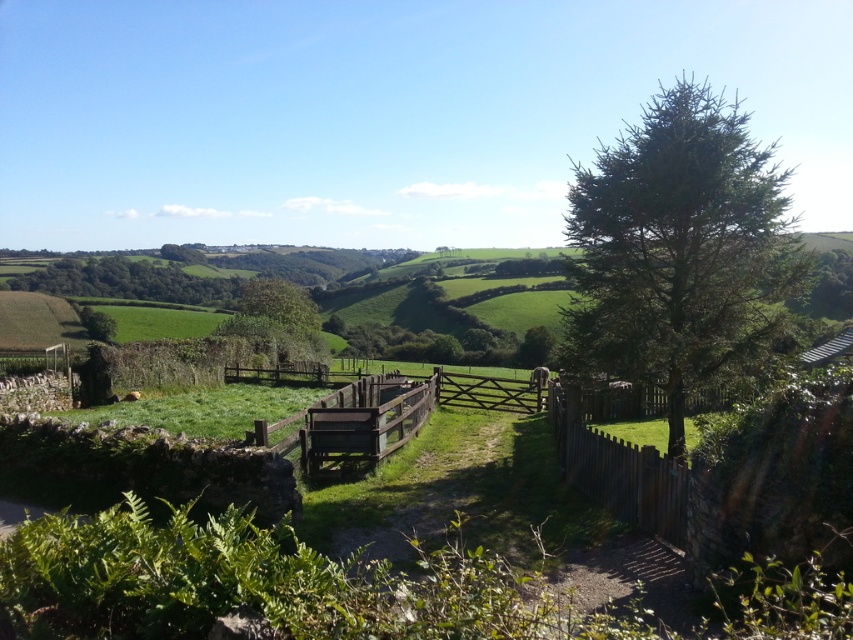
You are a painter setting up your easel in the countryside scene. You want to paint both the brown wooden fence at right and the brown wooden fence at center. Which fence should you move closer to if you want to capture more details of the fence in your painting?

You should move closer to the brown wooden fence at right because it is smaller in size compared to the brown wooden fence at center, allowing you to include more details of its structure in your painting when viewed from a closer distance.

From the picture: You are standing at the point marked as point [630,490] in the image. A friend is located 10 meters directly behind you. Can your friend see the stone wall on the left side of the image from their position?

The distance between you and the viewer is 9.30 meters. Since your friend is 10 meters behind you, they would be 19.30 meters away from the stone wall. The visibility depends on the terrain and obstructions, but the description mentions rolling hills and fields, which might block the view. However, the stone wall is in the foreground, so if there are no tall obstructions between them and the wall, they might see it. But the scene doesn t specify line of sight details beyond the given distance.

You are standing in the rural landscape shown in the image. If you face the brown wooden fence at right, which direction would you need to turn to see the stone wall partially covered by vegetation on the left side?

You would need to turn to your left to see the stone wall partially covered by vegetation on the left side, as the brown wooden fence at right is positioned to the east of the stone wall.